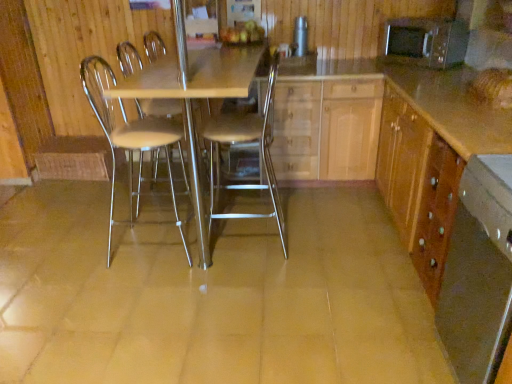
Find the location of a particular element. The width and height of the screenshot is (512, 384). vacant area to the left of metallic/transparent table at center is located at coordinates (92, 220).